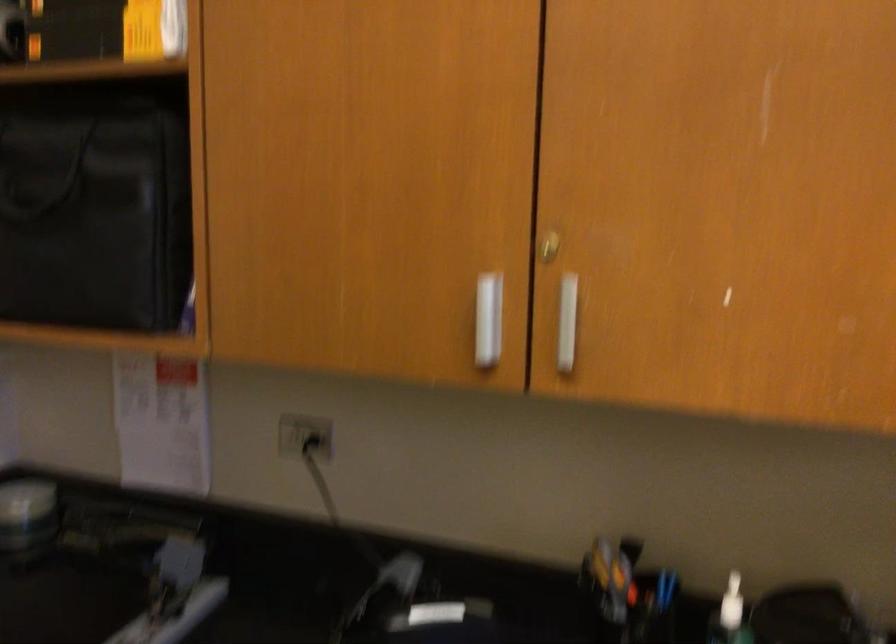
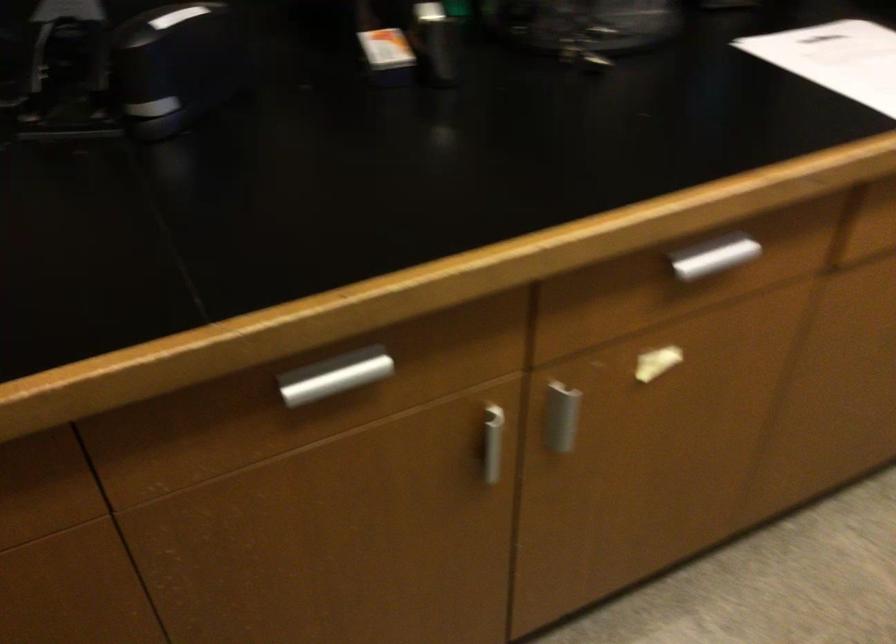
The images are taken continuously from a first-person perspective. In which direction is your viewpoint rotating?

The camera's rotation is toward right-down.